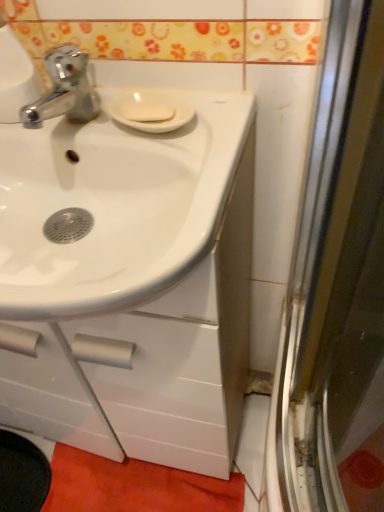
In order to click on free space above orange fabric bath mat at lower center (from a real-world perspective) in this screenshot , I will do `click(135, 484)`.